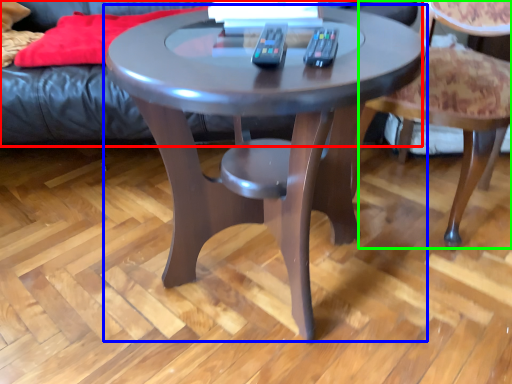
Question: Which object is the farthest from couch (highlighted by a red box)? Choose among these: coffee table (highlighted by a blue box) or chair (highlighted by a green box).

Choices:
 (A) coffee table
 (B) chair

Answer: (B)